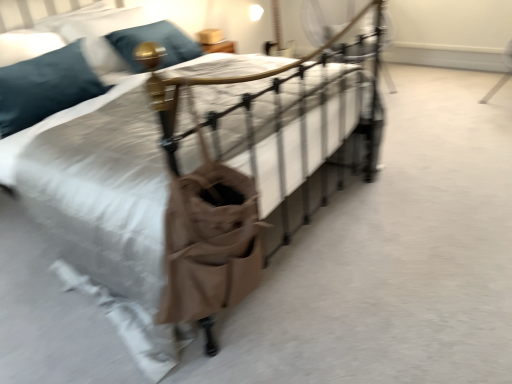
This screenshot has height=384, width=512. Describe the element at coordinates (96, 33) in the screenshot. I see `teal velvet pillow at upper left, the second pillow in the front-to-back sequence` at that location.

Locate an element on the screen. teal velvet pillow at upper left, the second pillow in the front-to-back sequence is located at coordinates (96, 33).

What is the approximate width of teal velvet pillow at upper left, which ranks as the first pillow in back-to-front order?

It is 15.69 inches.

The width and height of the screenshot is (512, 384). What do you see at coordinates (45, 87) in the screenshot? I see `teal fabric pillow at upper left, the first pillow positioned from the front` at bounding box center [45, 87].

Where is `teal fabric pillow at upper left, the 2th pillow from the back`? This screenshot has height=384, width=512. teal fabric pillow at upper left, the 2th pillow from the back is located at coordinates (45, 87).

Where is `teal velvet pillow at upper left, the second pillow in the front-to-back sequence`? The image size is (512, 384). teal velvet pillow at upper left, the second pillow in the front-to-back sequence is located at coordinates (96, 33).

Based on the photo, considering the positions of objects teal velvet pillow at upper left, which ranks as the first pillow in back-to-front order, and teal fabric pillow at upper left, the 2th pillow from the back, in the image provided, who is more to the right, teal velvet pillow at upper left, which ranks as the first pillow in back-to-front order, or teal fabric pillow at upper left, the 2th pillow from the back,?

Positioned to the right is teal velvet pillow at upper left, which ranks as the first pillow in back-to-front order.

Who is more distant, teal velvet pillow at upper left, which ranks as the first pillow in back-to-front order, or teal fabric pillow at upper left, the first pillow positioned from the front?

Positioned behind is teal velvet pillow at upper left, which ranks as the first pillow in back-to-front order.

Considering the points (103, 62) and (10, 95), which point is behind, point (103, 62) or point (10, 95)?

The point (103, 62) is behind.

From the image's perspective, which is above, teal velvet pillow at upper left, which ranks as the first pillow in back-to-front order, or teal fabric pillow at upper left, the 2th pillow from the back?

teal velvet pillow at upper left, which ranks as the first pillow in back-to-front order.

Looking at this image, from a real-world perspective, is teal velvet pillow at upper left, the second pillow in the front-to-back sequence, located higher than teal fabric pillow at upper left, the first pillow positioned from the front?

Yes, from a real-world perspective, teal velvet pillow at upper left, the second pillow in the front-to-back sequence, is over teal fabric pillow at upper left, the first pillow positioned from the front

Which of these two, teal velvet pillow at upper left, the second pillow in the front-to-back sequence, or teal fabric pillow at upper left, the first pillow positioned from the front, is thinner?

teal velvet pillow at upper left, the second pillow in the front-to-back sequence, is thinner.

From their relative heights in the image, would you say teal velvet pillow at upper left, the second pillow in the front-to-back sequence, is taller or shorter than teal fabric pillow at upper left, the 2th pillow from the back?

Considering their sizes, teal velvet pillow at upper left, the second pillow in the front-to-back sequence, has less height than teal fabric pillow at upper left, the 2th pillow from the back.

Does teal velvet pillow at upper left, which ranks as the first pillow in back-to-front order, have a larger size compared to teal fabric pillow at upper left, the 2th pillow from the back?

Incorrect, teal velvet pillow at upper left, which ranks as the first pillow in back-to-front order, is not larger than teal fabric pillow at upper left, the 2th pillow from the back.

Do you think teal velvet pillow at upper left, which ranks as the first pillow in back-to-front order, is within teal fabric pillow at upper left, the first pillow positioned from the front, or outside of it?

teal velvet pillow at upper left, which ranks as the first pillow in back-to-front order, is located beyond the bounds of teal fabric pillow at upper left, the first pillow positioned from the front.

Would you consider teal velvet pillow at upper left, which ranks as the first pillow in back-to-front order, to be distant from teal fabric pillow at upper left, the 2th pillow from the back?

teal velvet pillow at upper left, which ranks as the first pillow in back-to-front order, is near teal fabric pillow at upper left, the 2th pillow from the back, not far away.

Is teal fabric pillow at upper left, the 2th pillow from the back, at the back of teal velvet pillow at upper left, the second pillow in the front-to-back sequence?

No, teal velvet pillow at upper left, the second pillow in the front-to-back sequence, is not facing the opposite direction of teal fabric pillow at upper left, the 2th pillow from the back.

How many degrees apart are the facing directions of teal velvet pillow at upper left, which ranks as the first pillow in back-to-front order, and teal fabric pillow at upper left, the first pillow positioned from the front?

They differ by 3 degrees in their facing directions.

How much distance is there between teal velvet pillow at upper left, which ranks as the first pillow in back-to-front order, and teal fabric pillow at upper left, the first pillow positioned from the front?

18.48 inches.

At what (x,y) coordinates should I click in order to perform the action: click on pillow above the teal fabric pillow at upper left, the 2th pillow from the back (from the image's perspective). Please return your answer as a coordinate pair (x, y). Looking at the image, I should click on (96, 33).

Considering the relative positions of teal fabric pillow at upper left, the first pillow positioned from the front, and teal velvet pillow at upper left, the second pillow in the front-to-back sequence, in the image provided, is teal fabric pillow at upper left, the first pillow positioned from the front, to the right of teal velvet pillow at upper left, the second pillow in the front-to-back sequence, from the viewer's perspective?

In fact, teal fabric pillow at upper left, the first pillow positioned from the front, is to the left of teal velvet pillow at upper left, the second pillow in the front-to-back sequence.

Between teal fabric pillow at upper left, the first pillow positioned from the front, and teal velvet pillow at upper left, which ranks as the first pillow in back-to-front order, which one is positioned in front?

teal fabric pillow at upper left, the first pillow positioned from the front, is closer to the camera.

Which is behind, point (101, 84) or point (103, 31)?

The point (103, 31) is behind.

In the scene shown: From the image's perspective, is teal fabric pillow at upper left, the 2th pillow from the back, on top of teal velvet pillow at upper left, the second pillow in the front-to-back sequence?

No.

From a real-world perspective, relative to teal velvet pillow at upper left, the second pillow in the front-to-back sequence, is teal fabric pillow at upper left, the first pillow positioned from the front, vertically above or below?

Clearly, from a real-world perspective, teal fabric pillow at upper left, the first pillow positioned from the front, is below teal velvet pillow at upper left, the second pillow in the front-to-back sequence.

Can you confirm if teal fabric pillow at upper left, the first pillow positioned from the front, is wider than teal velvet pillow at upper left, which ranks as the first pillow in back-to-front order?

Correct, the width of teal fabric pillow at upper left, the first pillow positioned from the front, exceeds that of teal velvet pillow at upper left, which ranks as the first pillow in back-to-front order.

Is teal fabric pillow at upper left, the first pillow positioned from the front, shorter than teal velvet pillow at upper left, which ranks as the first pillow in back-to-front order?

No.

Does teal fabric pillow at upper left, the 2th pillow from the back, have a larger size compared to teal velvet pillow at upper left, which ranks as the first pillow in back-to-front order?

Correct, teal fabric pillow at upper left, the 2th pillow from the back, is larger in size than teal velvet pillow at upper left, which ranks as the first pillow in back-to-front order.

Is teal fabric pillow at upper left, the first pillow positioned from the front, surrounding teal velvet pillow at upper left, which ranks as the first pillow in back-to-front order?

No, teal velvet pillow at upper left, which ranks as the first pillow in back-to-front order, is not surrounded by teal fabric pillow at upper left, the first pillow positioned from the front.

Based on the photo, is teal fabric pillow at upper left, the first pillow positioned from the front, next to teal velvet pillow at upper left, the second pillow in the front-to-back sequence, and touching it?

No, teal fabric pillow at upper left, the first pillow positioned from the front, is not beside teal velvet pillow at upper left, the second pillow in the front-to-back sequence.

Is teal fabric pillow at upper left, the first pillow positioned from the front, positioned with its back to teal velvet pillow at upper left, the second pillow in the front-to-back sequence?

That's not correct — teal fabric pillow at upper left, the first pillow positioned from the front, is not looking away from teal velvet pillow at upper left, the second pillow in the front-to-back sequence.

You are a GUI agent. You are given a task and a screenshot of the screen. Output one action in this format:
    pyautogui.click(x=<x>, y=<y>)
    Task: Click on the pillow to the right of teal fabric pillow at upper left, the first pillow positioned from the front
    The height and width of the screenshot is (384, 512).
    Given the screenshot: What is the action you would take?
    pyautogui.click(x=96, y=33)

This screenshot has height=384, width=512. In order to click on pillow that is behind the teal fabric pillow at upper left, the first pillow positioned from the front in this screenshot , I will do `click(96, 33)`.

Locate an element on the screen. pillow below the teal velvet pillow at upper left, the second pillow in the front-to-back sequence (from a real-world perspective) is located at coordinates (45, 87).